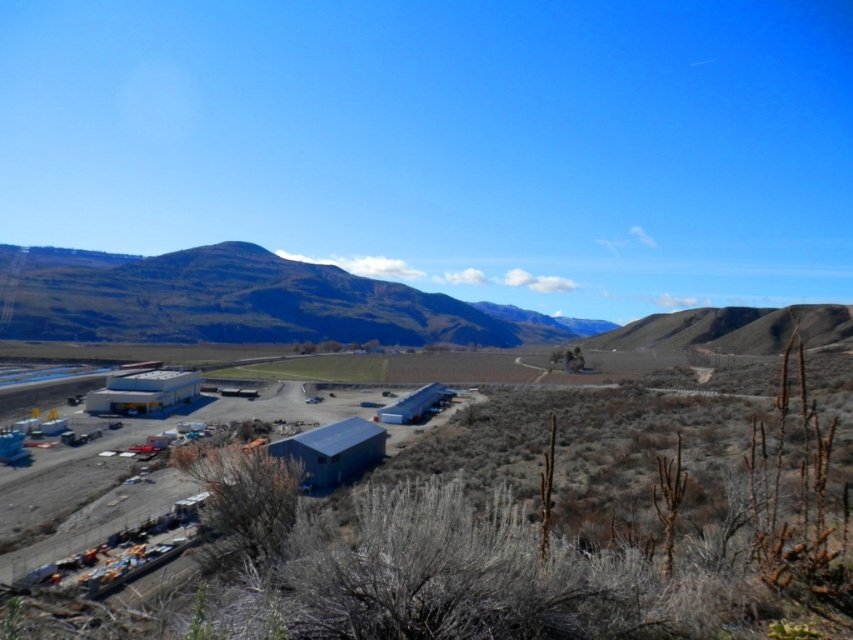
Question: Among these objects, which one is nearest to the camera?

Choices:
 (A) blue metallic building at center
 (B) brown/dry grassy hill at right

Answer: (A)

Question: Which of the following is the farthest from the observer?

Choices:
 (A) brown/dry grassy hill at right
 (B) blue metallic building at center

Answer: (A)

Question: Among these objects, which one is nearest to the camera?

Choices:
 (A) green grassy hill at upper left
 (B) blue metallic building at center

Answer: (B)

Question: Is blue metallic building at center to the right of brown/dry grassy hill at right from the viewer's perspective?

Choices:
 (A) yes
 (B) no

Answer: (B)

Question: Is blue metallic building at center above brown/dry grassy hill at right?

Choices:
 (A) yes
 (B) no

Answer: (B)

Question: Can you confirm if green grassy hill at upper left is wider than brown/dry grassy hill at right?

Choices:
 (A) yes
 (B) no

Answer: (A)